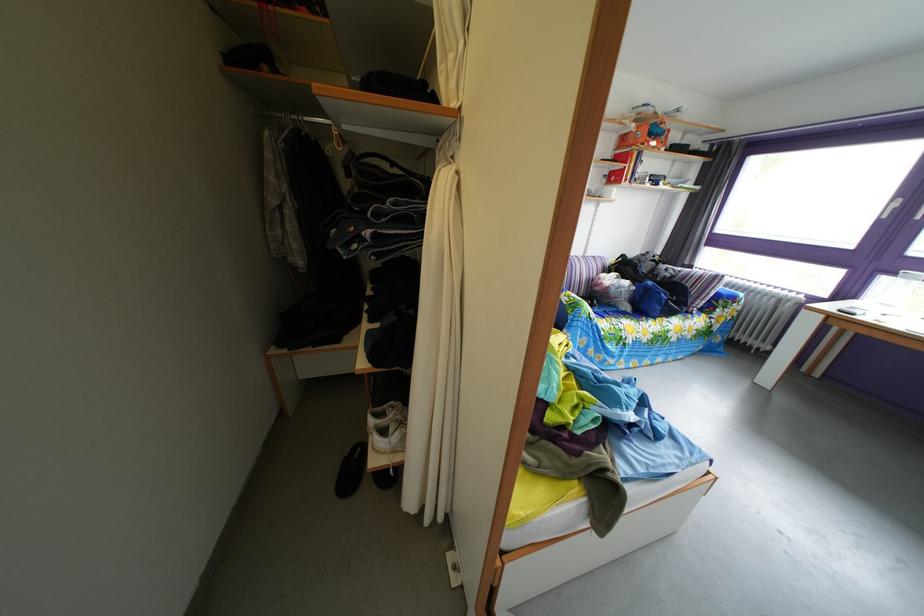
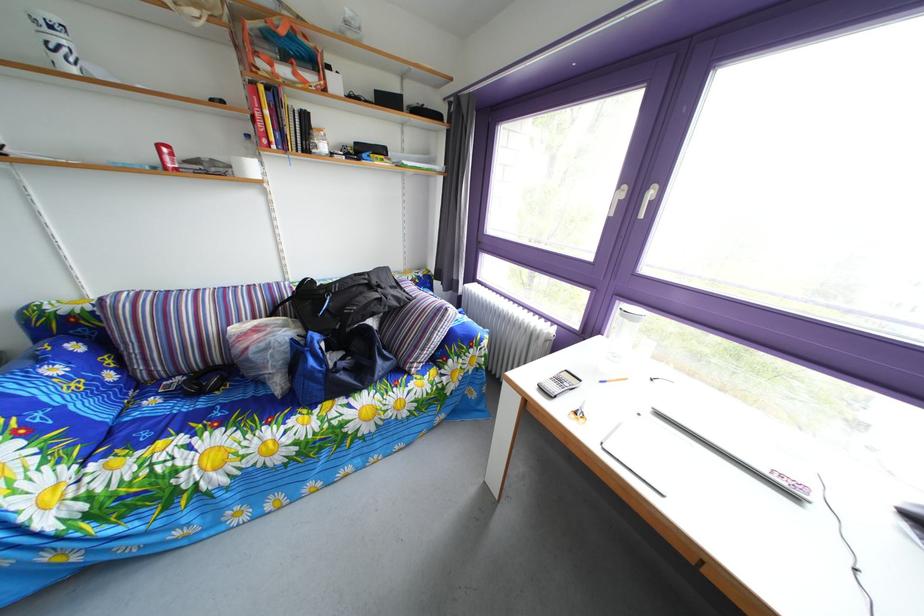
What movement of the cameraman would produce the second image?

The cameraman walked toward right, forward.